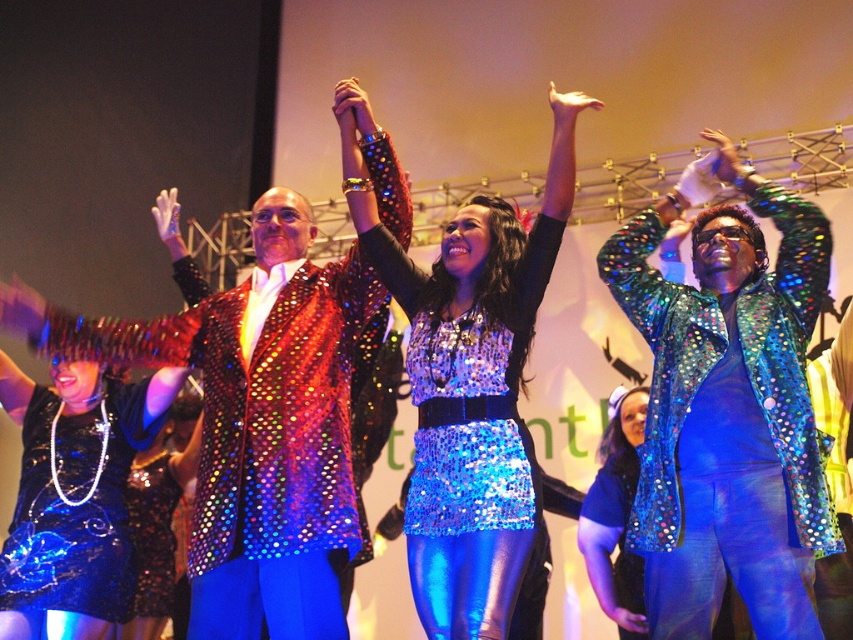
In the scene shown: Who is positioned more to the right, shiny sequin dress at center or blue sequined dress at center?

Positioned to the right is blue sequined dress at center.

Does shiny sequin dress at center appear on the left side of blue sequined dress at center?

Correct, you'll find shiny sequin dress at center to the left of blue sequined dress at center.

Who is more forward, [541,269] or [614,500]?

Point [541,269] is more forward.

I want to click on shiny sequin dress at center, so click(463, 262).

Can you confirm if shiny sequined jacket at center is smaller than blue sequined dress at center?

No, shiny sequined jacket at center is not smaller than blue sequined dress at center.

Is shiny sequined jacket at center positioned in front of blue sequined dress at center?

Yes, shiny sequined jacket at center is in front of blue sequined dress at center.

The width and height of the screenshot is (853, 640). In order to click on shiny sequined jacket at center in this screenshot , I will do `click(253, 424)`.

Does shiny sequin dress at center lie behind matte gold hand at upper center?

No, it is in front of matte gold hand at upper center.

Between shiny sequin dress at center and matte gold hand at upper center, which one has less height?

matte gold hand at upper center is shorter.

Between point (457, 268) and point (578, 100), which one is positioned in front?

Point (578, 100)

I want to click on shiny sequin dress at center, so click(x=463, y=262).